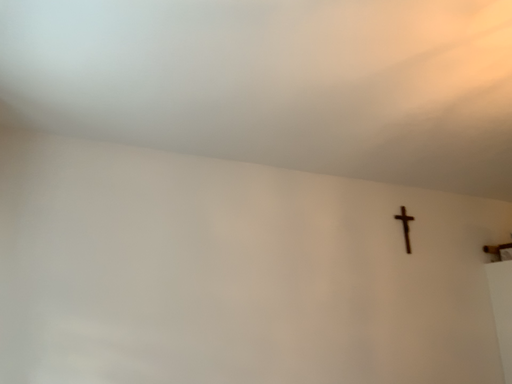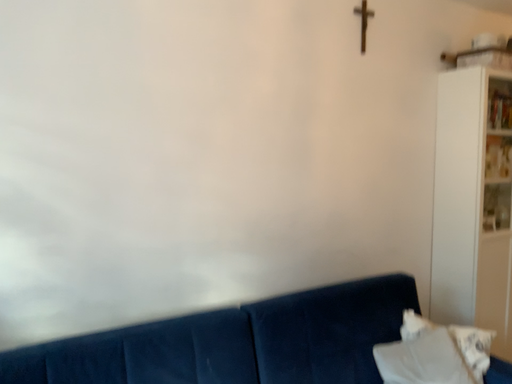
Question: How did the camera likely rotate when shooting the video?

Choices:
 (A) rotated upward
 (B) rotated downward

Answer: (B)